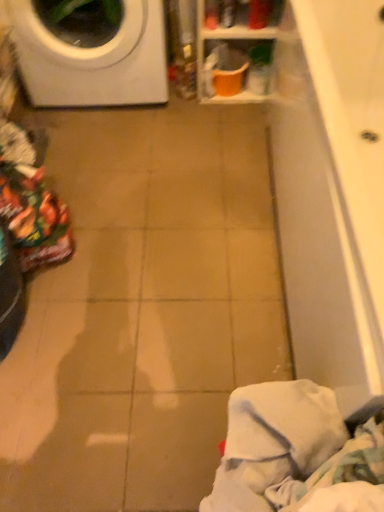
Question: Does orange plastic bucket at upper center have a greater height compared to white soft cloth at lower right?

Choices:
 (A) yes
 (B) no

Answer: (A)

Question: Is white soft cloth at lower right surrounded by orange plastic bucket at upper center?

Choices:
 (A) no
 (B) yes

Answer: (A)

Question: Is orange plastic bucket at upper center oriented towards white soft cloth at lower right?

Choices:
 (A) yes
 (B) no

Answer: (A)

Question: Are orange plastic bucket at upper center and white soft cloth at lower right beside each other?

Choices:
 (A) no
 (B) yes

Answer: (A)

Question: Is white soft cloth at lower right at the back of orange plastic bucket at upper center?

Choices:
 (A) yes
 (B) no

Answer: (B)

Question: Considering the positions of orange plastic bucket at upper center and white glossy washing machine at upper left in the image, is orange plastic bucket at upper center wider or thinner than white glossy washing machine at upper left?

Choices:
 (A) thin
 (B) wide

Answer: (A)

Question: From a real-world perspective, is orange plastic bucket at upper center physically located above or below white glossy washing machine at upper left?

Choices:
 (A) below
 (B) above

Answer: (A)

Question: From the image's perspective, is orange plastic bucket at upper center above or below white glossy washing machine at upper left?

Choices:
 (A) above
 (B) below

Answer: (B)

Question: In terms of size, does orange plastic bucket at upper center appear bigger or smaller than white glossy washing machine at upper left?

Choices:
 (A) big
 (B) small

Answer: (B)

Question: Relative to orange plastic bucket at upper center, is white soft cloth at lower right in front or behind?

Choices:
 (A) front
 (B) behind

Answer: (A)

Question: From a real-world perspective, is white soft cloth at lower right positioned above or below orange plastic bucket at upper center?

Choices:
 (A) above
 (B) below

Answer: (A)

Question: From the image's perspective, is white soft cloth at lower right above or below orange plastic bucket at upper center?

Choices:
 (A) above
 (B) below

Answer: (B)

Question: Based on their positions, is white soft cloth at lower right located to the left or right of orange plastic bucket at upper center?

Choices:
 (A) right
 (B) left

Answer: (B)

Question: Is point (241, 454) positioned closer to the camera than point (13, 0)?

Choices:
 (A) closer
 (B) farther

Answer: (A)

Question: From the image's perspective, relative to white glossy washing machine at upper left, is white soft cloth at lower right above or below?

Choices:
 (A) below
 (B) above

Answer: (A)